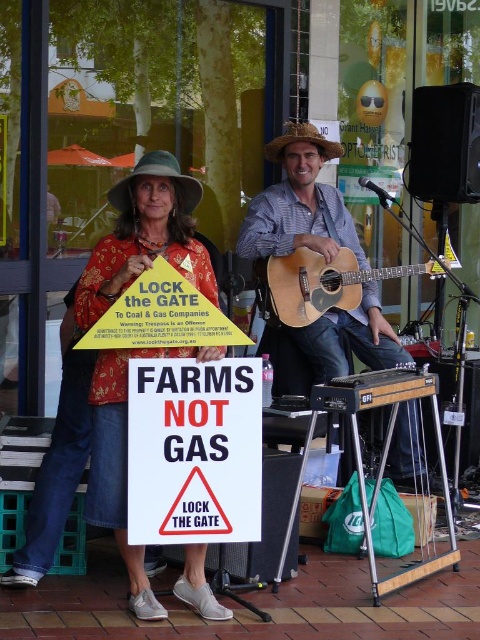
Question: Where is floral fabric shirt at center located in relation to strawhat at center in the image?

Choices:
 (A) below
 (B) above

Answer: (A)

Question: Does white paper sign at center have a greater width compared to green felt cowboy hat at upper center?

Choices:
 (A) yes
 (B) no

Answer: (A)

Question: Among these points, which one is farthest from the camera?

Choices:
 (A) (181, 202)
 (B) (169, 262)
 (C) (257, 504)
 (D) (437, 273)

Answer: (D)

Question: Among these points, which one is farthest from the camera?

Choices:
 (A) (363, 273)
 (B) (222, 460)
 (C) (120, 506)
 (D) (303, 129)

Answer: (A)

Question: Which point is closer to the camera taking this photo?

Choices:
 (A) (98, 486)
 (B) (338, 156)

Answer: (A)

Question: Is wooden acoustic guitar at center thinner than green felt cowboy hat at upper center?

Choices:
 (A) no
 (B) yes

Answer: (A)